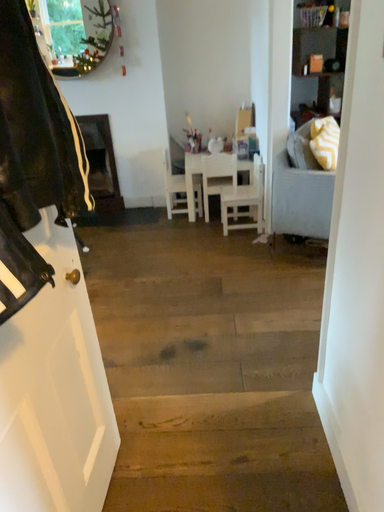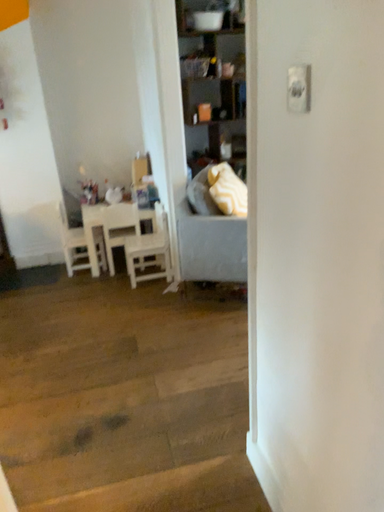
Question: Which way did the camera rotate in the video?

Choices:
 (A) rotated downward
 (B) rotated upward

Answer: (B)